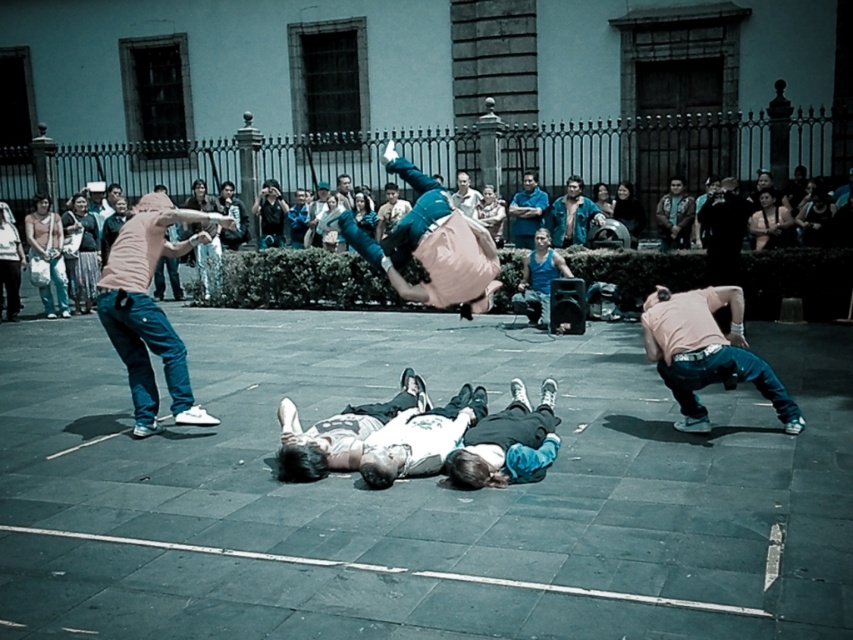
Question: Which point is closer to the camera?

Choices:
 (A) (680, 256)
 (B) (767, 221)

Answer: (A)

Question: Which point is farther to the camera?

Choices:
 (A) (463, 170)
 (B) (259, 220)

Answer: (A)

Question: Among these objects, which one is nearest to the camera?

Choices:
 (A) pink cotton hoodie at left
 (B) denim jacket at upper left
 (C) denim jacket at upper center

Answer: (A)

Question: Can you confirm if pink cotton shirt at lower right is smaller than smooth black hair at upper center?

Choices:
 (A) no
 (B) yes

Answer: (A)

Question: Is matte pink shirt at upper center below teal fabric shirt at center?

Choices:
 (A) no
 (B) yes

Answer: (B)

Question: Does pink fabric at center appear on the left side of denim jacket at upper left?

Choices:
 (A) no
 (B) yes

Answer: (A)